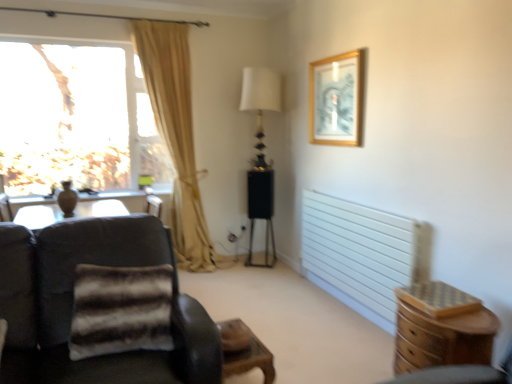
Question: Looking at their shapes, would you say transparent glass window at upper left is wider or thinner than white glossy table lamp at center?

Choices:
 (A) wide
 (B) thin

Answer: (B)

Question: Would you say transparent glass window at upper left is inside or outside white glossy table lamp at center?

Choices:
 (A) inside
 (B) outside

Answer: (B)

Question: Which object is positioned farthest from the wooden chest of drawers at lower right?

Choices:
 (A) wooden side table at lower center
 (B) white matte radiator at right
 (C) beige fabric curtain at left
 (D) transparent glass window at upper left
 (E) white glossy table lamp at center

Answer: (D)

Question: Which is farther from the dark brown leather chair at left?

Choices:
 (A) wooden chest of drawers at lower right
 (B) beige fabric curtain at left
 (C) white matte radiator at right
 (D) gold-framed picture at upper right
 (E) transparent glass window at upper left

Answer: (E)